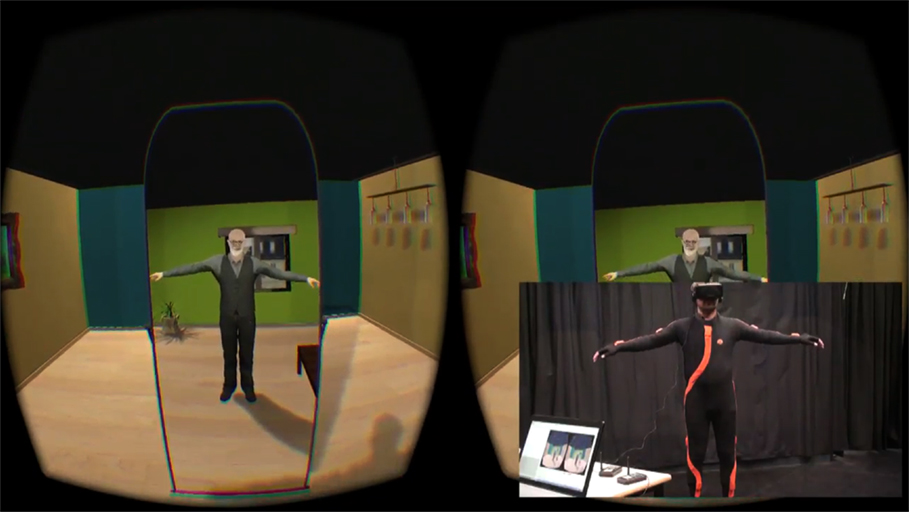
In order to click on wood floor in this screenshot , I will do coord(136,428), coord(495,396).